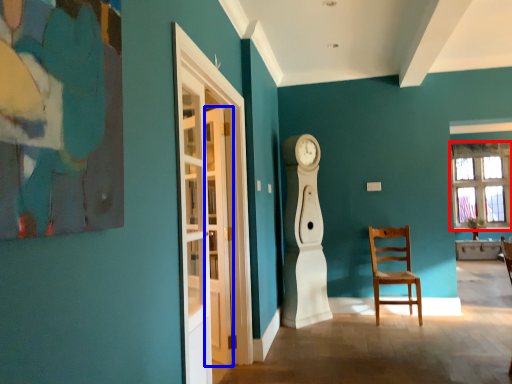
Question: Among these objects, which one is farthest to the camera, window (highlighted by a red box) or door (highlighted by a blue box)?

Choices:
 (A) window
 (B) door

Answer: (A)